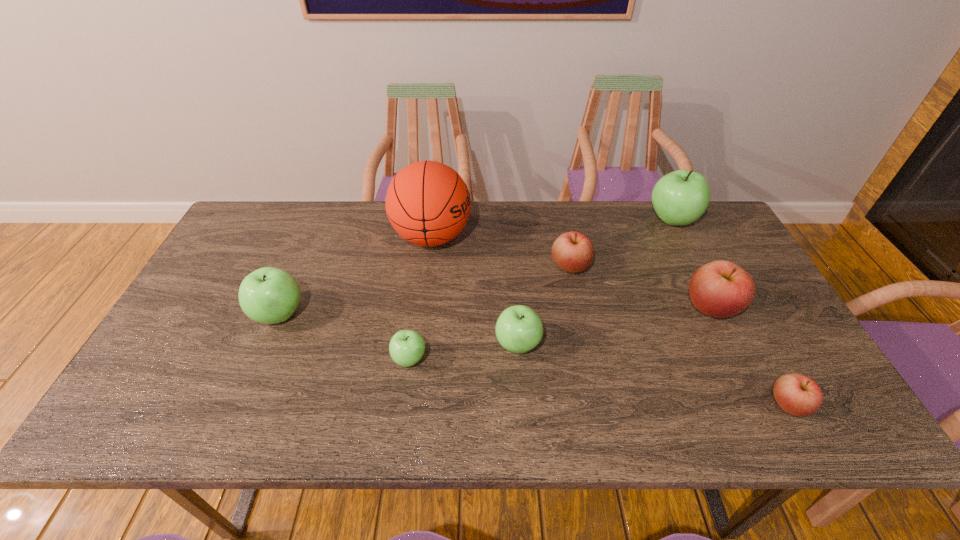
The height and width of the screenshot is (540, 960). What are the coordinates of `vacant area that lies between the basketball and the second green apple from left to right` in the screenshot? It's located at (420, 298).

Locate an element on the screen. Image resolution: width=960 pixels, height=540 pixels. free space between the second green apple from right to left and the nearest apple is located at coordinates (653, 374).

Select which object appears as the second closest to the third apple from left to right. Please provide its 2D coordinates. Your answer should be formatted as a tuple, i.e. [(x, y)], where the tuple contains the x and y coordinates of a point satisfying the conditions above.

[(573, 252)]

Identify the location of object that stands as the sixth closest to the biggest red apple. (406, 348).

The height and width of the screenshot is (540, 960). What are the coordinates of `the second closest apple to the leftmost apple` in the screenshot? It's located at (519, 329).

Image resolution: width=960 pixels, height=540 pixels. Find the location of `apple that is the second closest one to the second farthest red apple`. apple that is the second closest one to the second farthest red apple is located at coordinates (679, 198).

In order to click on green apple that is the third closest one to the second farthest apple in this screenshot , I will do `click(406, 348)`.

Where is `the second closest green apple to the nearest apple`? the second closest green apple to the nearest apple is located at coordinates (679, 198).

Where is `red apple that stands as the second closest to the fourth apple from left to right`? red apple that stands as the second closest to the fourth apple from left to right is located at coordinates (799, 395).

Select which red apple is the closest to the tallest apple. Please provide its 2D coordinates. Your answer should be formatted as a tuple, i.e. [(x, y)], where the tuple contains the x and y coordinates of a point satisfying the conditions above.

[(720, 289)]